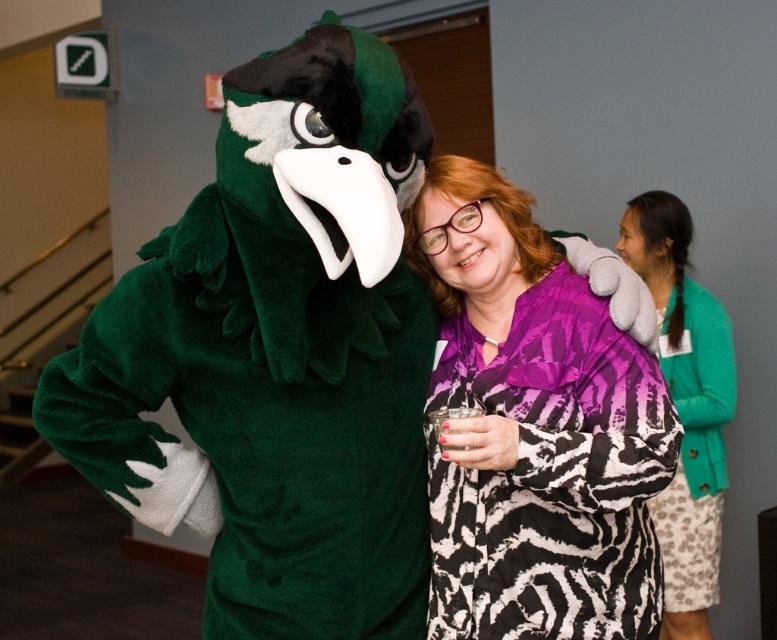
Question: Can you confirm if purple printed shirt at center is wider than green fuzzy sweater at right?

Choices:
 (A) yes
 (B) no

Answer: (A)

Question: In this image, where is purple printed shirt at center located relative to green fuzzy sweater at right?

Choices:
 (A) left
 (B) right

Answer: (A)

Question: Which point is closer to the camera?

Choices:
 (A) (490, 625)
 (B) (674, 260)

Answer: (A)

Question: Does purple printed shirt at center appear on the right side of green fuzzy sweater at right?

Choices:
 (A) no
 (B) yes

Answer: (A)

Question: Which point appears closest to the camera in this image?

Choices:
 (A) (615, 392)
 (B) (640, 196)

Answer: (A)